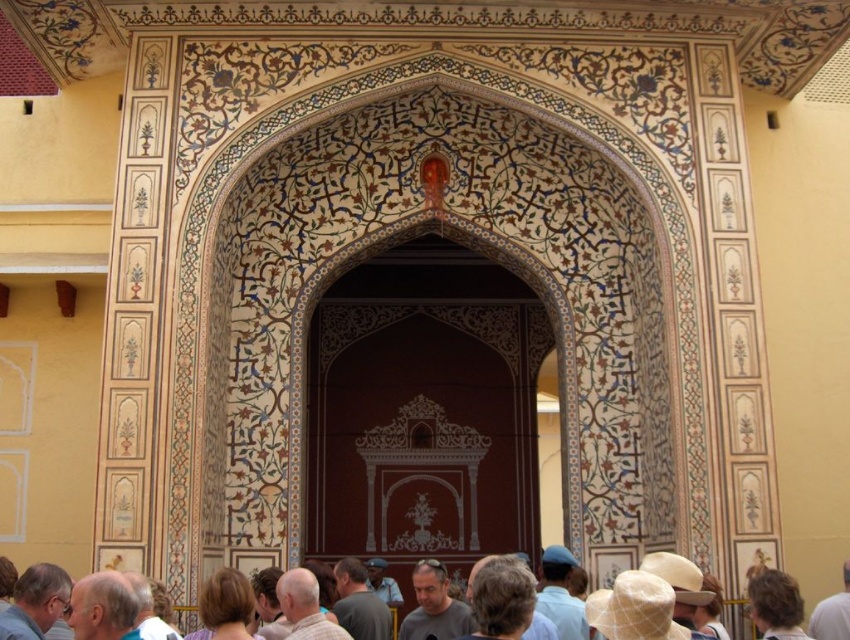
Question: Which object appears farthest from the camera in this image?

Choices:
 (A) brown glossy door at center
 (B) blue fabric hat at lower center
 (C) blonde hair at center

Answer: (A)

Question: Can you confirm if gray hair at lower left is smaller than gray fabric head at center?

Choices:
 (A) no
 (B) yes

Answer: (A)

Question: Can you confirm if brown glossy door at center is positioned to the left of gray fabric shirt at center?

Choices:
 (A) yes
 (B) no

Answer: (B)

Question: Which of the following is the closest to the observer?

Choices:
 (A) light brown hair at lower center
 (B) brown glossy door at center

Answer: (A)

Question: Does gray hair at lower left come behind blonde hair at center?

Choices:
 (A) no
 (B) yes

Answer: (B)

Question: Which of the following is the farthest from the observer?

Choices:
 (A) (219, 596)
 (B) (502, 637)
 (C) (783, 572)
 (D) (570, 605)

Answer: (D)